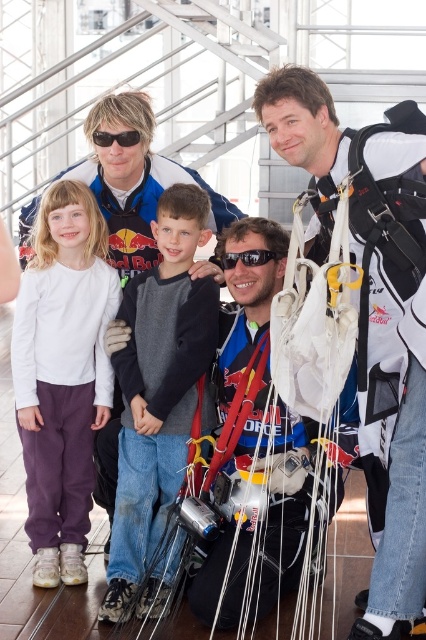
Which is more to the left, white parachute at right or black plastic goggles at center?

Positioned to the left is black plastic goggles at center.

At what (x,y) coordinates should I click in order to perform the action: click on white parachute at right. Please return your answer as a coordinate pair (x, y). Looking at the image, I should click on (374, 314).

Between point (334, 141) and point (265, 262), which one is positioned behind?

Positioned behind is point (265, 262).

Identify the location of white parachute at right. This screenshot has width=426, height=640. (374, 314).

Can you confirm if white parachute at right is thinner than white soft shirt at center?

In fact, white parachute at right might be wider than white soft shirt at center.

Does white parachute at right have a smaller size compared to white soft shirt at center?

No.

What are the coordinates of `white parachute at right` in the screenshot? It's located at (374, 314).

Where is `white parachute at right`? This screenshot has height=640, width=426. white parachute at right is located at coordinates (374, 314).

Locate an element on the screen. This screenshot has width=426, height=640. gray cotton hoodie at center is located at coordinates (158, 401).

Who is higher up, gray cotton hoodie at center or black plastic goggles at center?

black plastic goggles at center is higher up.

At what (x,y) coordinates should I click in order to perform the action: click on gray cotton hoodie at center. Please return your answer as a coordinate pair (x, y). The height and width of the screenshot is (640, 426). Looking at the image, I should click on (158, 401).

Image resolution: width=426 pixels, height=640 pixels. I want to click on gray cotton hoodie at center, so click(158, 401).